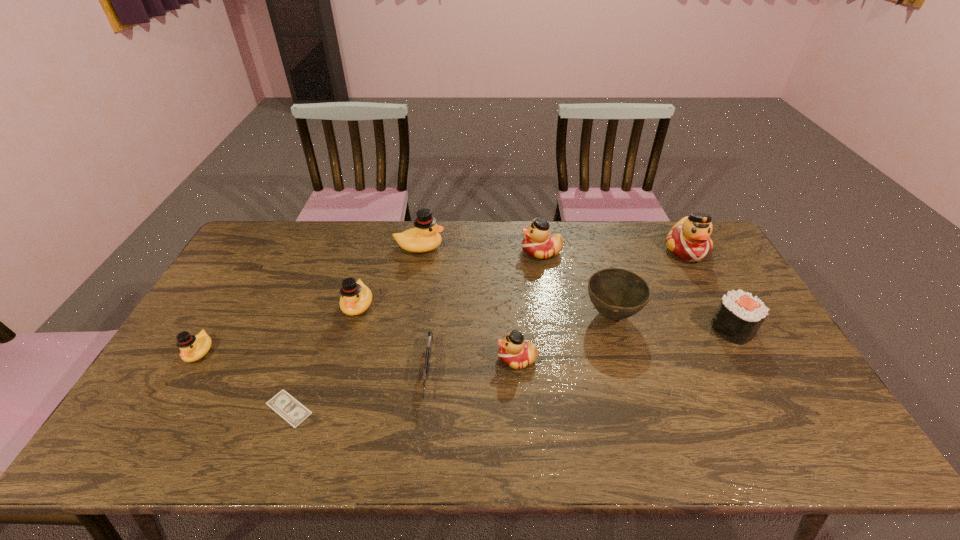
Choose which duck is the fifth nearest neighbor to the biggest yellow duck. Please provide its 2D coordinates. Your answer should be formatted as a tuple, i.e. [(x, y)], where the tuple contains the x and y coordinates of a point satisfying the conditions above.

[(689, 239)]

Where is `red duck that stands as the closest to the money`? Image resolution: width=960 pixels, height=540 pixels. red duck that stands as the closest to the money is located at coordinates (515, 352).

Where is `red duck that is the third closest to the sushi`? This screenshot has width=960, height=540. red duck that is the third closest to the sushi is located at coordinates (515, 352).

Locate which yellow duck ranks in proximity to the second farthest yellow duck. Please provide its 2D coordinates. Your answer should be formatted as a tuple, i.e. [(x, y)], where the tuple contains the x and y coordinates of a point satisfying the conditions above.

[(425, 237)]

Locate an element on the screen. The image size is (960, 540). yellow duck that is the third closest one to the sushi is located at coordinates (193, 348).

At what (x,y) coordinates should I click in order to perform the action: click on free location that satisfies the following two spatial constraints: 1. on the back side of the third object from right to left; 2. on the front-facing side of the rightmost yellow duck. Please return your answer as a coordinate pair (x, y). The height and width of the screenshot is (540, 960). Looking at the image, I should click on (591, 247).

Find the location of a particular element. The width and height of the screenshot is (960, 540). free point that satisfies the following two spatial constraints: 1. on the face of the second biggest red duck; 2. on the back side of the bowl is located at coordinates (552, 315).

Identify the location of free space in the image that satisfies the following two spatial constraints: 1. on the front-facing side of the sushi; 2. on the left side of the farthest yellow duck. The width and height of the screenshot is (960, 540). (406, 329).

The height and width of the screenshot is (540, 960). I want to click on free space that satisfies the following two spatial constraints: 1. on the front-facing side of the farthest yellow duck; 2. on the front-facing side of the leftmost object, so click(402, 352).

The image size is (960, 540). Find the location of `free location that satisfies the following two spatial constraints: 1. on the face of the nearest red duck; 2. on the front side of the green money`. free location that satisfies the following two spatial constraints: 1. on the face of the nearest red duck; 2. on the front side of the green money is located at coordinates (521, 408).